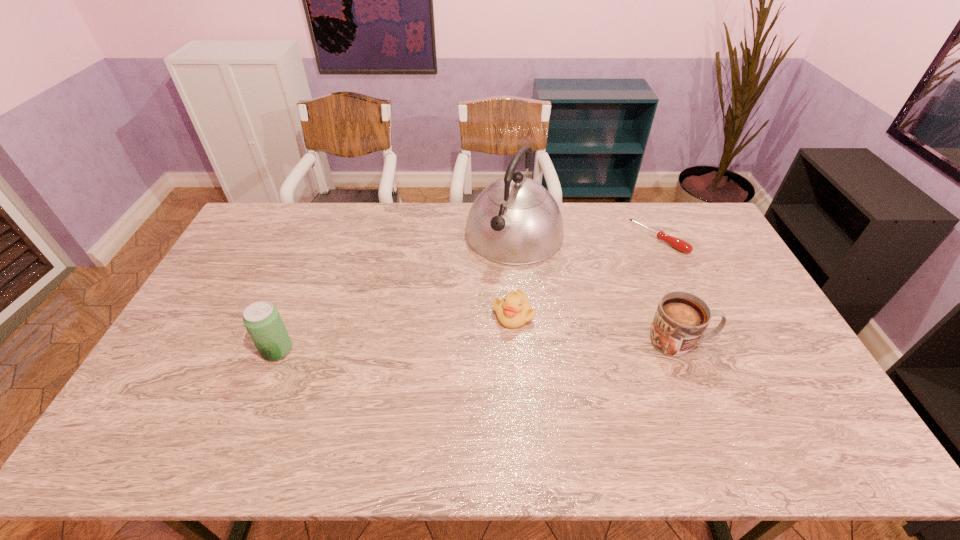
Where is `soda`? This screenshot has width=960, height=540. soda is located at coordinates (262, 320).

Image resolution: width=960 pixels, height=540 pixels. In order to click on mug in this screenshot , I will do `click(681, 318)`.

Image resolution: width=960 pixels, height=540 pixels. What are the coordinates of `kettle` in the screenshot? It's located at (516, 221).

At what (x,y) coordinates should I click in order to perform the action: click on screwdriver. Please return your answer as a coordinate pair (x, y). The width and height of the screenshot is (960, 540). Looking at the image, I should click on (679, 244).

Image resolution: width=960 pixels, height=540 pixels. What are the coordinates of `duckling` in the screenshot? It's located at (514, 311).

This screenshot has width=960, height=540. What are the coordinates of `free space located 0.280m on the back of the soda` in the screenshot? It's located at (309, 272).

At what (x,y) coordinates should I click in order to perform the action: click on vacant point located on the side of the mug with the handle. Please return your answer as a coordinate pair (x, y). Looking at the image, I should click on (748, 342).

Locate an element on the screen. vacant space located 0.240m from the spout of the tallest object is located at coordinates (468, 313).

This screenshot has width=960, height=540. In order to click on free space located 0.050m from the spout of the tallest object in this screenshot , I will do `click(492, 273)`.

I want to click on vacant region located from the spout of the tallest object, so click(x=479, y=295).